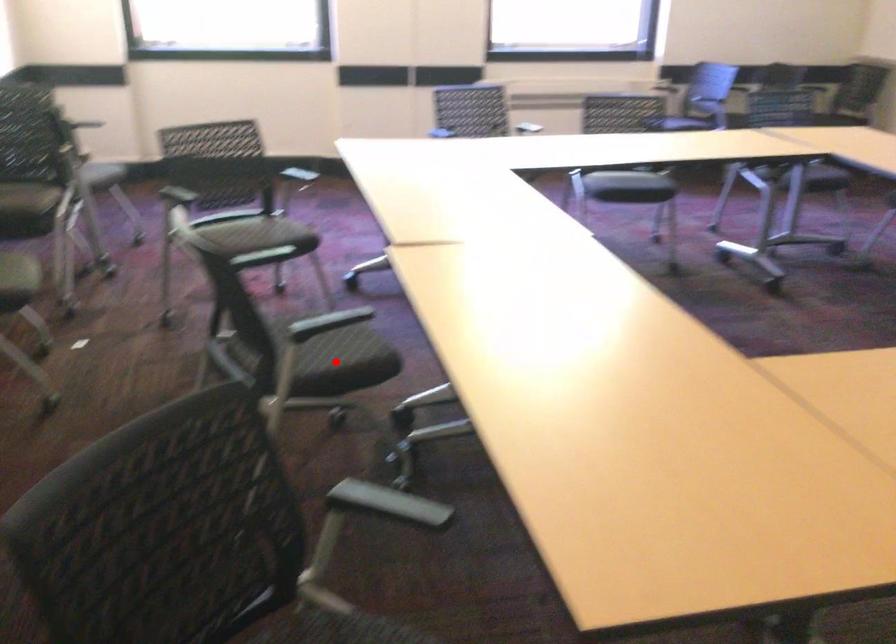
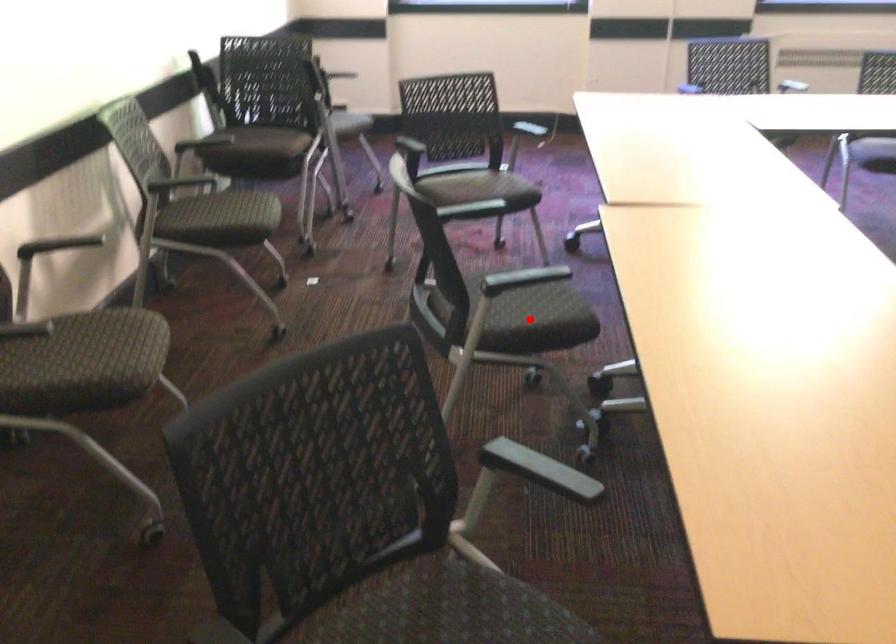
I am providing you with two images of the same scene from different viewpoints. A red point is marked on the first image and another point is marked on the second image. Does the point marked in image1 correspond to the same location as the one in image2?

Yes